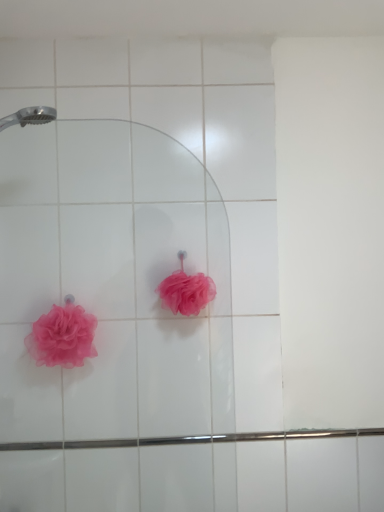
How much space does pink matte loofah at center, marked as the first rose in a right-to-left arrangement, occupy horizontally?

pink matte loofah at center, marked as the first rose in a right-to-left arrangement, is 5.38 inches in width.

In order to click on pink matte loofah at center, which appears as the second rose when viewed from the left in this screenshot , I will do `click(186, 292)`.

What do you see at coordinates (186, 292) in the screenshot? I see `pink matte loofah at center, which appears as the second rose when viewed from the left` at bounding box center [186, 292].

You are a GUI agent. You are given a task and a screenshot of the screen. Output one action in this format:
    pyautogui.click(x=<x>, y=<y>)
    Task: Click on the pink mesh sponge at lower left, the second rose in the right-to-left sequence
    
    Given the screenshot: What is the action you would take?
    pyautogui.click(x=62, y=336)

In order to face pink mesh sponge at lower left, the second rose in the right-to-left sequence, should I rotate leftwards or rightwards?

To face it directly, rotate left by 17.240 degrees.

What is the approximate width of pink mesh sponge at lower left, the second rose in the right-to-left sequence?

pink mesh sponge at lower left, the second rose in the right-to-left sequence, is 4.92 inches in width.

The width and height of the screenshot is (384, 512). What do you see at coordinates (62, 336) in the screenshot? I see `pink mesh sponge at lower left, the second rose in the right-to-left sequence` at bounding box center [62, 336].

Image resolution: width=384 pixels, height=512 pixels. Identify the location of pink matte loofah at center, which appears as the second rose when viewed from the left. (186, 292).

Which object is positioned more to the right, pink matte loofah at center, marked as the first rose in a right-to-left arrangement, or pink mesh sponge at lower left, the first rose when ordered from left to right?

pink matte loofah at center, marked as the first rose in a right-to-left arrangement, is more to the right.

Which object is more forward, pink matte loofah at center, marked as the first rose in a right-to-left arrangement, or pink mesh sponge at lower left, the first rose when ordered from left to right?

pink mesh sponge at lower left, the first rose when ordered from left to right.

Between point (192, 294) and point (45, 315), which one is positioned in front?

Positioned in front is point (192, 294).

From the image's perspective, is pink matte loofah at center, marked as the first rose in a right-to-left arrangement, beneath pink mesh sponge at lower left, the first rose when ordered from left to right?

No.

From a real-world perspective, which is physically below, pink matte loofah at center, which appears as the second rose when viewed from the left, or pink mesh sponge at lower left, the second rose in the right-to-left sequence?

In real-world perspective, pink mesh sponge at lower left, the second rose in the right-to-left sequence, is lower.

Does pink matte loofah at center, which appears as the second rose when viewed from the left, have a greater width compared to pink mesh sponge at lower left, the first rose when ordered from left to right?

Yes.

From the picture: Between pink matte loofah at center, which appears as the second rose when viewed from the left, and pink mesh sponge at lower left, the first rose when ordered from left to right, which one has more height?

→ With more height is pink mesh sponge at lower left, the first rose when ordered from left to right.

Considering the relative sizes of pink matte loofah at center, marked as the first rose in a right-to-left arrangement, and pink mesh sponge at lower left, the second rose in the right-to-left sequence, in the image provided, is pink matte loofah at center, marked as the first rose in a right-to-left arrangement, bigger than pink mesh sponge at lower left, the second rose in the right-to-left sequence,?

No, pink matte loofah at center, marked as the first rose in a right-to-left arrangement, is not bigger than pink mesh sponge at lower left, the second rose in the right-to-left sequence.

Is pink mesh sponge at lower left, the second rose in the right-to-left sequence, a part of pink matte loofah at center, marked as the first rose in a right-to-left arrangement?

No, pink mesh sponge at lower left, the second rose in the right-to-left sequence, is not surrounded by pink matte loofah at center, marked as the first rose in a right-to-left arrangement.

Is pink matte loofah at center, marked as the first rose in a right-to-left arrangement, with pink mesh sponge at lower left, the second rose in the right-to-left sequence?

No, pink matte loofah at center, marked as the first rose in a right-to-left arrangement, is not touching pink mesh sponge at lower left, the second rose in the right-to-left sequence.

Is pink matte loofah at center, which appears as the second rose when viewed from the left, aimed at pink mesh sponge at lower left, the first rose when ordered from left to right?

No, pink matte loofah at center, which appears as the second rose when viewed from the left, is not turned towards pink mesh sponge at lower left, the first rose when ordered from left to right.

What's the angular difference between pink matte loofah at center, which appears as the second rose when viewed from the left, and pink mesh sponge at lower left, the second rose in the right-to-left sequence,'s facing directions?

There is a 0.000175-degree angle between the facing directions of pink matte loofah at center, which appears as the second rose when viewed from the left, and pink mesh sponge at lower left, the second rose in the right-to-left sequence.

In the image, there is a pink matte loofah at center, marked as the first rose in a right-to-left arrangement. At what (x,y) coordinates should I click in order to perform the action: click on rose below it (from a real-world perspective). Please return your answer as a coordinate pair (x, y). This screenshot has height=512, width=384. Looking at the image, I should click on (62, 336).

Considering the relative positions of pink mesh sponge at lower left, the first rose when ordered from left to right, and pink matte loofah at center, which appears as the second rose when viewed from the left, in the image provided, is pink mesh sponge at lower left, the first rose when ordered from left to right, to the right of pink matte loofah at center, which appears as the second rose when viewed from the left, from the viewer's perspective?

Incorrect, pink mesh sponge at lower left, the first rose when ordered from left to right, is not on the right side of pink matte loofah at center, which appears as the second rose when viewed from the left.

Which object is closer to the camera taking this photo, pink mesh sponge at lower left, the first rose when ordered from left to right, or pink matte loofah at center, marked as the first rose in a right-to-left arrangement?

Positioned in front is pink mesh sponge at lower left, the first rose when ordered from left to right.

Is point (79, 318) farther from camera compared to point (164, 286)?

Yes, it is behind point (164, 286).

From the image's perspective, would you say pink mesh sponge at lower left, the first rose when ordered from left to right, is shown under pink matte loofah at center, which appears as the second rose when viewed from the left?

Yes, from the image's perspective, pink mesh sponge at lower left, the first rose when ordered from left to right, is below pink matte loofah at center, which appears as the second rose when viewed from the left.

From a real-world perspective, which object rests below the other?

pink mesh sponge at lower left, the second rose in the right-to-left sequence.

Does pink mesh sponge at lower left, the first rose when ordered from left to right, have a lesser width compared to pink matte loofah at center, marked as the first rose in a right-to-left arrangement?

Correct, the width of pink mesh sponge at lower left, the first rose when ordered from left to right, is less than that of pink matte loofah at center, marked as the first rose in a right-to-left arrangement.

Considering the relative sizes of pink mesh sponge at lower left, the first rose when ordered from left to right, and pink matte loofah at center, marked as the first rose in a right-to-left arrangement, in the image provided, is pink mesh sponge at lower left, the first rose when ordered from left to right, taller than pink matte loofah at center, marked as the first rose in a right-to-left arrangement,?

Correct, pink mesh sponge at lower left, the first rose when ordered from left to right, is much taller as pink matte loofah at center, marked as the first rose in a right-to-left arrangement.

In the scene shown: Is pink mesh sponge at lower left, the second rose in the right-to-left sequence, smaller than pink matte loofah at center, marked as the first rose in a right-to-left arrangement?

Actually, pink mesh sponge at lower left, the second rose in the right-to-left sequence, might be larger than pink matte loofah at center, marked as the first rose in a right-to-left arrangement.

Is pink mesh sponge at lower left, the first rose when ordered from left to right, located outside pink matte loofah at center, marked as the first rose in a right-to-left arrangement?

Yes, pink mesh sponge at lower left, the first rose when ordered from left to right, is not within pink matte loofah at center, marked as the first rose in a right-to-left arrangement.

Are pink mesh sponge at lower left, the first rose when ordered from left to right, and pink matte loofah at center, marked as the first rose in a right-to-left arrangement, located far from each other?

No, pink mesh sponge at lower left, the first rose when ordered from left to right, is not far away from pink matte loofah at center, marked as the first rose in a right-to-left arrangement.

Based on the photo, is pink mesh sponge at lower left, the second rose in the right-to-left sequence, facing away from pink matte loofah at center, which appears as the second rose when viewed from the left?

No, pink mesh sponge at lower left, the second rose in the right-to-left sequence, is not facing the opposite direction of pink matte loofah at center, which appears as the second rose when viewed from the left.

How distant is pink mesh sponge at lower left, the second rose in the right-to-left sequence, from pink matte loofah at center, marked as the first rose in a right-to-left arrangement?

15.14 inches.

Find the location of `rose that is in front of the pink matte loofah at center, which appears as the second rose when viewed from the left`. rose that is in front of the pink matte loofah at center, which appears as the second rose when viewed from the left is located at coordinates (62, 336).

Find the location of a particular element. The image size is (384, 512). rose on the left of pink matte loofah at center, marked as the first rose in a right-to-left arrangement is located at coordinates (62, 336).

At what (x,y) coordinates should I click in order to perform the action: click on rose above the pink mesh sponge at lower left, the second rose in the right-to-left sequence (from the image's perspective). Please return your answer as a coordinate pair (x, y). The image size is (384, 512). Looking at the image, I should click on (186, 292).